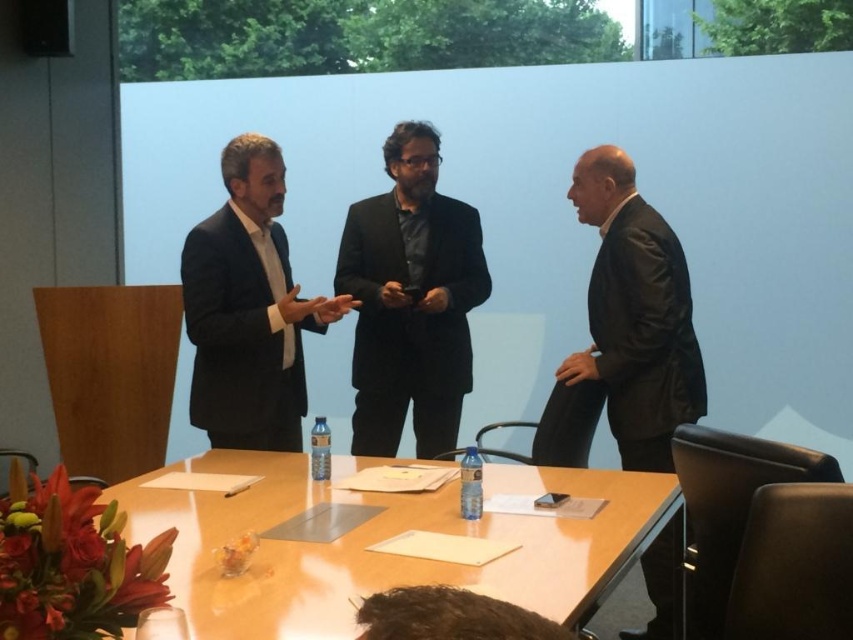
Question: Which object is positioned farthest from the black leather jacket at right?

Choices:
 (A) wooden table at center
 (B) matte black suit at center

Answer: (B)

Question: Which point is closer to the camera?

Choices:
 (A) (402, 132)
 (B) (492, 592)

Answer: (B)

Question: Which object is closer to the camera taking this photo?

Choices:
 (A) black leather jacket at right
 (B) black matte suit at center
 (C) matte black suit at center

Answer: (A)

Question: Does black leather jacket at right have a greater width compared to matte black suit at center?

Choices:
 (A) yes
 (B) no

Answer: (A)

Question: From the image, what is the correct spatial relationship of black matte suit at center in relation to matte black suit at center?

Choices:
 (A) right
 (B) left

Answer: (A)

Question: Does black leather jacket at right appear under black matte suit at center?

Choices:
 (A) no
 (B) yes

Answer: (B)